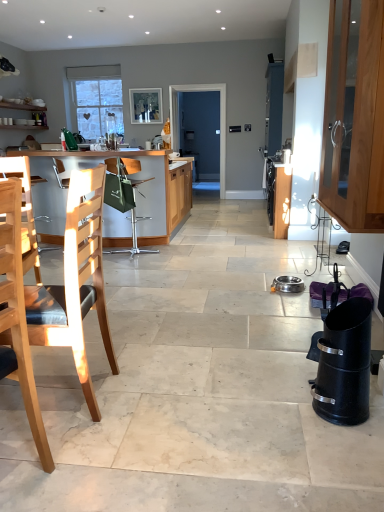
Locate an element on the screen. The width and height of the screenshot is (384, 512). spots to the right of light wood chair at left, marked as the first chair in a front-to-back arrangement is located at coordinates (78, 475).